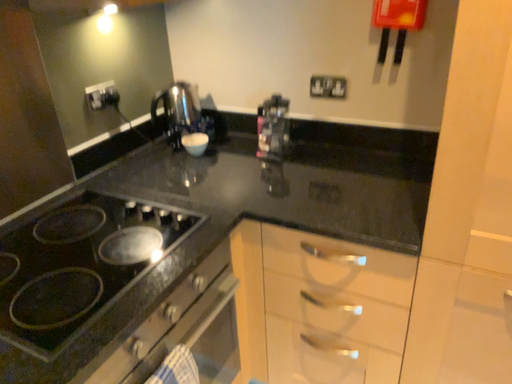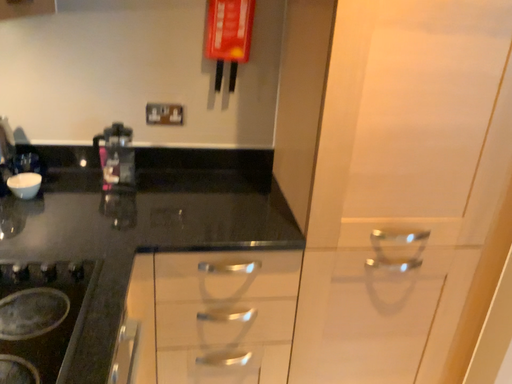
Question: How did the camera likely rotate when shooting the video?

Choices:
 (A) rotated downward
 (B) rotated upward

Answer: (B)